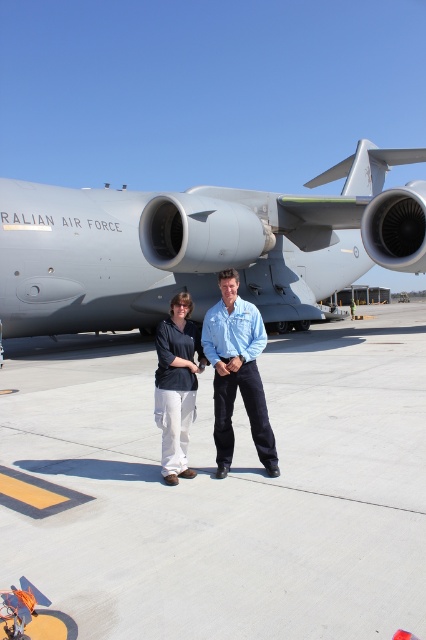
You are a photographer standing on the smooth concrete tarmac at center and want to take a photo of the gray matte airplane at center. Since you are on the tarmac, will you have to crouch down to avoid the airplane blocking your view of the background?

The smooth concrete tarmac at center is closer to the viewer than gray matte airplane at center, so you would not need to crouch down because the airplane is further away and won t block your view of the background.

You are a photographer positioned at the front of the gray matte airplane at center. You want to take a photo of the light blue shirt at center without the airplane blocking the view. Is it possible to do so from your current position?

The light blue shirt at center is behind the gray matte airplane at center, so it would be blocked by the airplane. To take a photo without the airplane blocking the view, you would need to move to a position where the airplane is no longer between you and the light blue shirt at center.